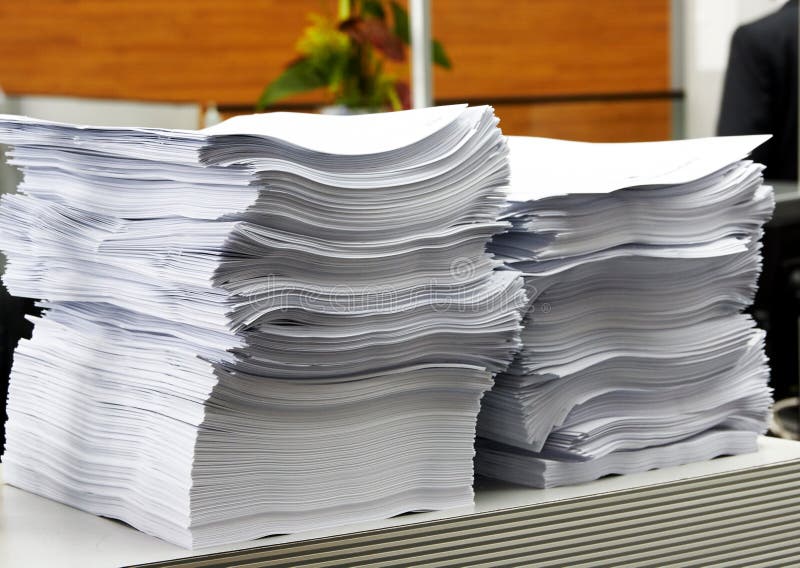
Where is `wall`? Image resolution: width=800 pixels, height=568 pixels. wall is located at coordinates [x=617, y=62].